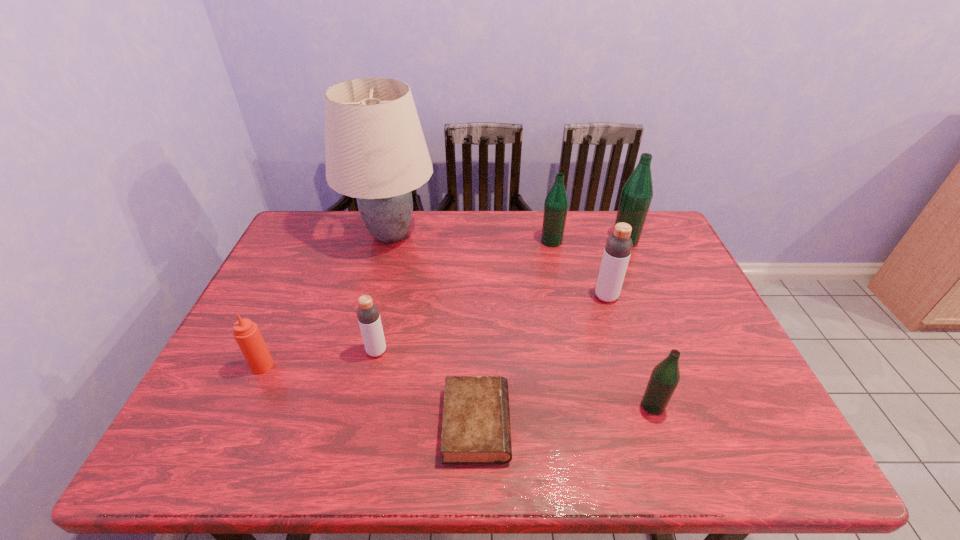
Locate an element on the screen. The width and height of the screenshot is (960, 540). unoccupied area between the smallest green bottle and the fourth bottle from right to left is located at coordinates (602, 323).

In order to click on free space between the second smallest green bottle and the Tabasco sauce in this screenshot , I will do `click(407, 303)`.

You are a GUI agent. You are given a task and a screenshot of the screen. Output one action in this format:
    pyautogui.click(x=<x>, y=<y>)
    Task: Click on the free space between the fourth object from left to right and the fourth farthest object
    Image resolution: width=960 pixels, height=540 pixels.
    Given the screenshot: What is the action you would take?
    pyautogui.click(x=541, y=360)

The image size is (960, 540). What are the coordinates of `vacant area that lies between the second tallest object and the second bottle from left to right` in the screenshot? It's located at (588, 241).

Where is `object identified as the second closest to the fifth nearest object`? The height and width of the screenshot is (540, 960). object identified as the second closest to the fifth nearest object is located at coordinates (556, 203).

This screenshot has height=540, width=960. Identify the location of object that ranks as the second closest to the fourth object from left to right. (665, 376).

This screenshot has height=540, width=960. Find the location of `bottle that is the fourth closest to the diary`. bottle that is the fourth closest to the diary is located at coordinates (556, 203).

You are a GUI agent. You are given a task and a screenshot of the screen. Output one action in this format:
    pyautogui.click(x=<x>, y=<y>)
    Task: Click on the fifth closest bottle to the leftmost object
    The width and height of the screenshot is (960, 540).
    Given the screenshot: What is the action you would take?
    pyautogui.click(x=637, y=193)

Where is `green bottle object that ranks as the second closest to the lampshade`? The width and height of the screenshot is (960, 540). green bottle object that ranks as the second closest to the lampshade is located at coordinates (637, 193).

Point out which green bottle is positioned as the nearest to the leftmost green bottle. Please provide its 2D coordinates. Your answer should be formatted as a tuple, i.e. [(x, y)], where the tuple contains the x and y coordinates of a point satisfying the conditions above.

[(637, 193)]